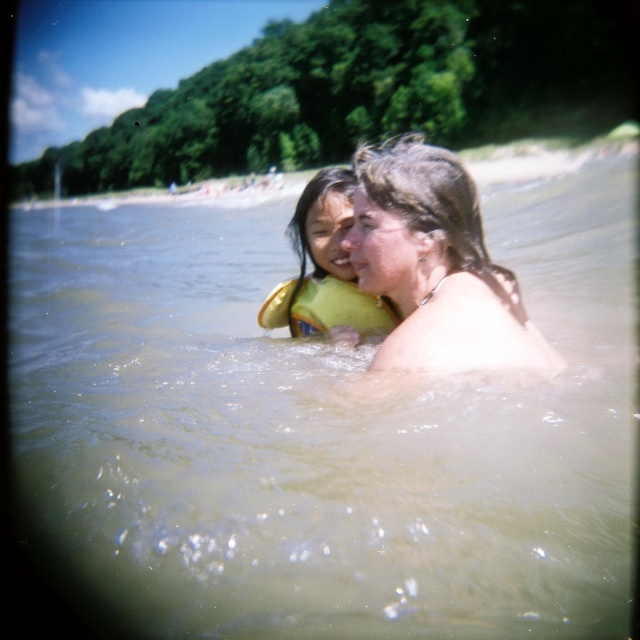
You are a lifeguard on duty and notice two swimmers in the water. You see the yellow life vest at center and the yellow fabric life jacket at center. Which one is positioned to the left?

The yellow life vest at center is positioned to the left of the yellow fabric life jacket at center.